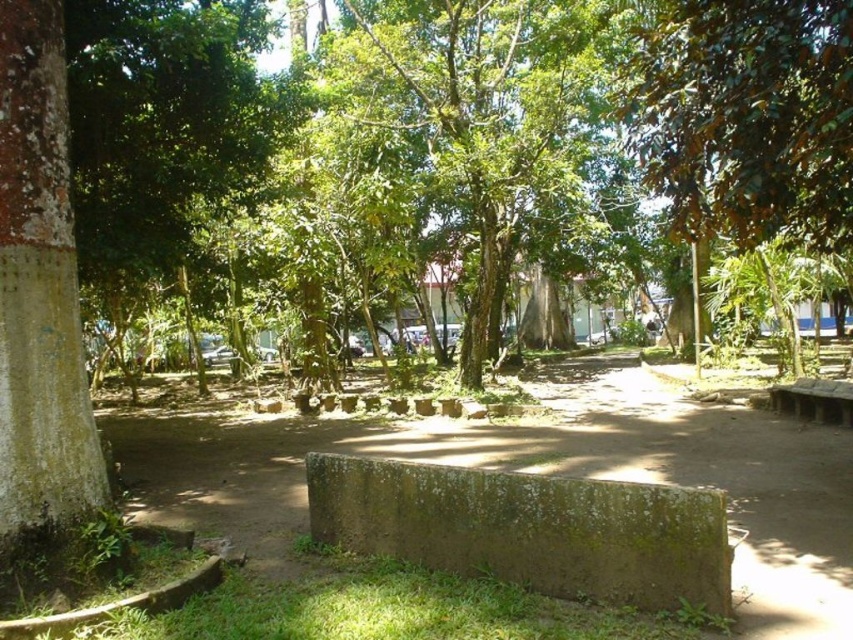
Which is in front, point (556, 531) or point (6, 134)?

Positioned in front is point (6, 134).

Can you confirm if green mossy concrete at center is positioned below smooth brown tree trunk at left?

Yes.

Is point (305, 465) farther from camera compared to point (12, 198)?

Yes, point (305, 465) is behind point (12, 198).

Locate an element on the screen. The height and width of the screenshot is (640, 853). green mossy concrete at center is located at coordinates (529, 529).

Is point (416, 99) farther from camera compared to point (22, 51)?

Yes, it is behind point (22, 51).

Consider the image. Which is more to the left, green leafy tree at center or smooth brown tree trunk at left?

smooth brown tree trunk at left

Which is behind, point (375, 76) or point (41, 237)?

Point (375, 76)

Locate an element on the screen. The image size is (853, 640). green leafy tree at center is located at coordinates (485, 120).

Who is positioned more to the left, smooth brown tree trunk at left or brown wooden bench at lower right?

smooth brown tree trunk at left is more to the left.

At what (x,y) coordinates should I click in order to perform the action: click on smooth brown tree trunk at left. Please return your answer as a coordinate pair (x, y). Looking at the image, I should click on (39, 288).

I want to click on smooth brown tree trunk at left, so (39, 288).